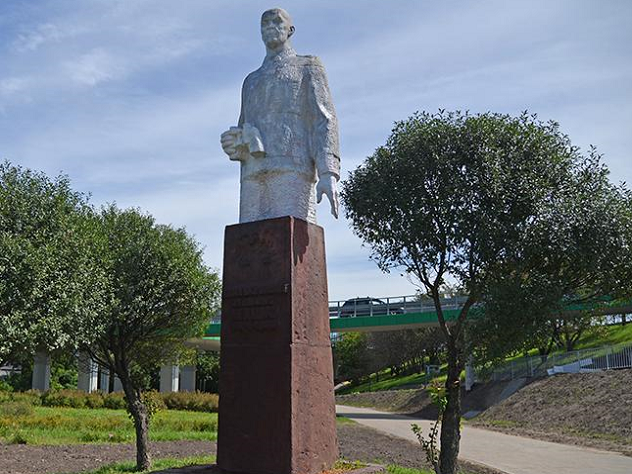
Find the location of `grey pillar`. grey pillar is located at coordinates (40, 378), (88, 385), (105, 384), (114, 386), (169, 380), (188, 380).